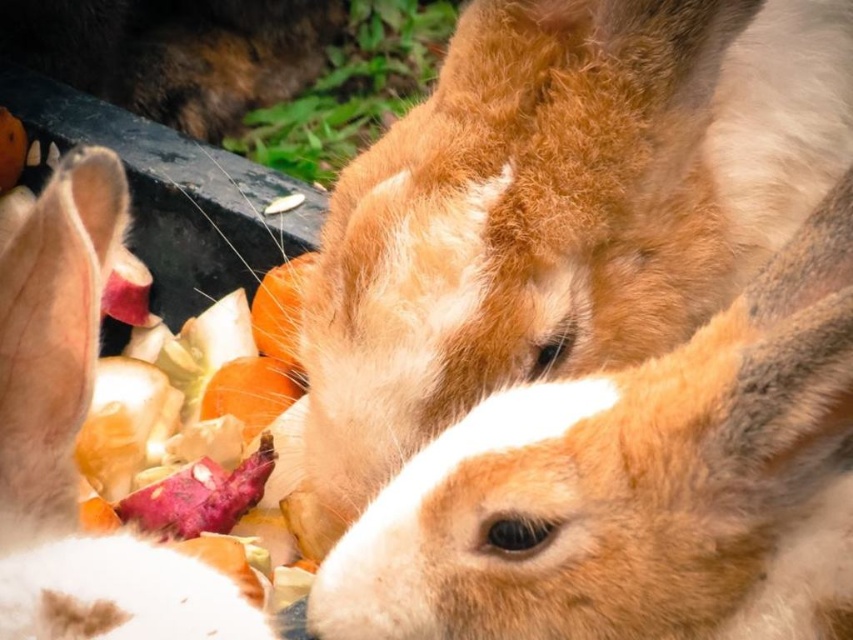
You are a veterinarian observing rabbits in their habitat. You notice the fuzzy brown rabbit at center and the white fur rabbit at left. Which rabbit would you estimate to be older based on their size?

The fuzzy brown rabbit at center is larger in size than the white fur rabbit at left, so it is likely the older one.

You are a photographer trying to capture a clear photo of the fuzzy brown rabbit at center and the white fur rabbit at left. Which rabbit will appear closer to the camera in the photo?

The fuzzy brown rabbit at center will appear closer to the camera because it is further to the viewer than the white fur rabbit at left.

You are a rabbit keeper who wants to place a feeding bowl between the fuzzy brown rabbit at center and the white fur rabbit at left. The bowl has a diameter of 30 centimeters. Will the rabbits be able to reach the bowl without moving closer?

The fuzzy brown rabbit at center and the white fur rabbit at left are 26.50 centimeters apart. Since the bowl has a diameter of 30 centimeters, placing it between them would mean the bowl extends beyond their current distance. This would require them to move slightly apart to access the bowl comfortably, so they might need to adjust their positions.